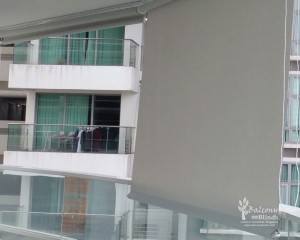
Where is `curtains`? The width and height of the screenshot is (300, 240). curtains is located at coordinates (80, 116), (51, 112), (77, 44), (56, 43), (111, 37).